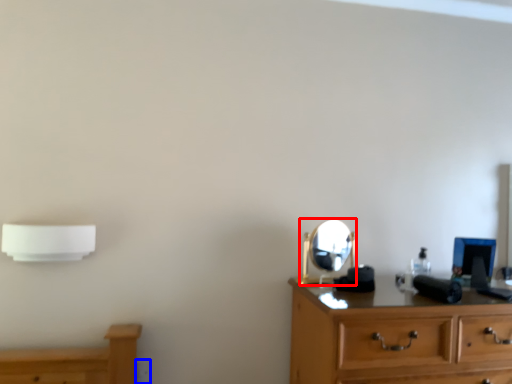
Question: Which point is closer to the camera, mirror (highlighted by a red box) or electric outlet (highlighted by a blue box)?

Choices:
 (A) mirror
 (B) electric outlet

Answer: (A)